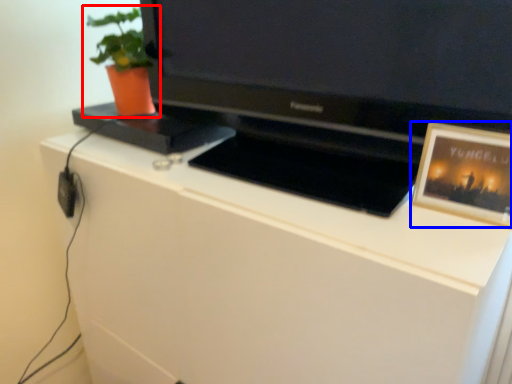
Question: Which object appears farthest to the camera in this image, houseplant (highlighted by a red box) or picture frame (highlighted by a blue box)?

Choices:
 (A) houseplant
 (B) picture frame

Answer: (A)